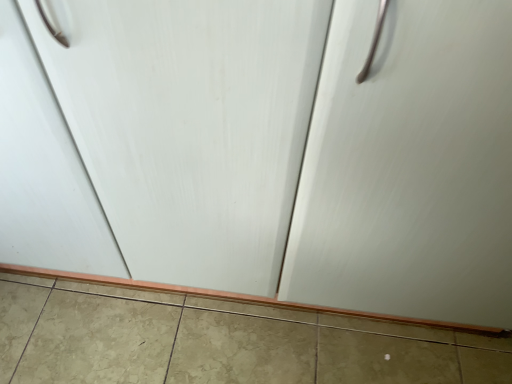
Where is `beige marble tile at lower center`? beige marble tile at lower center is located at coordinates (219, 341).

What do you see at coordinates (219, 341) in the screenshot? The image size is (512, 384). I see `beige marble tile at lower center` at bounding box center [219, 341].

Find the location of a particular element. The image size is (512, 384). beige marble tile at lower center is located at coordinates (219, 341).